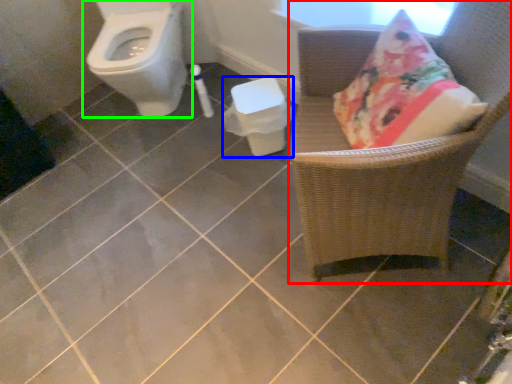
Question: Which object is positioned farthest from chair (highlighted by a red box)? Select from potty (highlighted by a blue box) and toilet (highlighted by a green box).

Choices:
 (A) potty
 (B) toilet

Answer: (B)